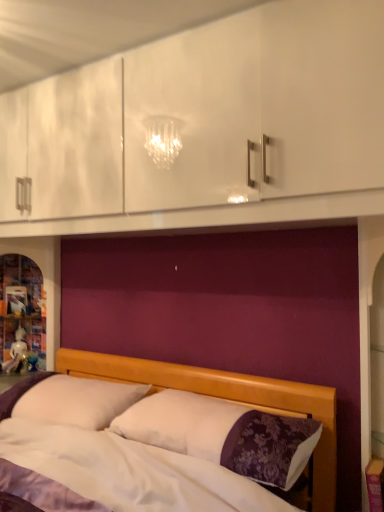
Question: Looking at the image, does white soft pillow at lower left seem bigger or smaller compared to wooden bed at center?

Choices:
 (A) big
 (B) small

Answer: (B)

Question: Considering the positions of white soft pillow at lower left and wooden bed at center in the image, is white soft pillow at lower left taller or shorter than wooden bed at center?

Choices:
 (A) tall
 (B) short

Answer: (B)

Question: From a real-world perspective, is white soft pillow at lower left positioned above or below wooden bed at center?

Choices:
 (A) above
 (B) below

Answer: (A)

Question: From a real-world perspective, is wooden bed at center positioned above or below white soft pillow at lower left?

Choices:
 (A) below
 (B) above

Answer: (A)

Question: Is point (172, 387) positioned closer to the camera than point (23, 402)?

Choices:
 (A) farther
 (B) closer

Answer: (A)

Question: From the image's perspective, relative to white soft pillow at lower left, is wooden bed at center above or below?

Choices:
 (A) below
 (B) above

Answer: (A)

Question: Is wooden bed at center spatially inside white soft pillow at lower left, or outside of it?

Choices:
 (A) outside
 (B) inside

Answer: (A)